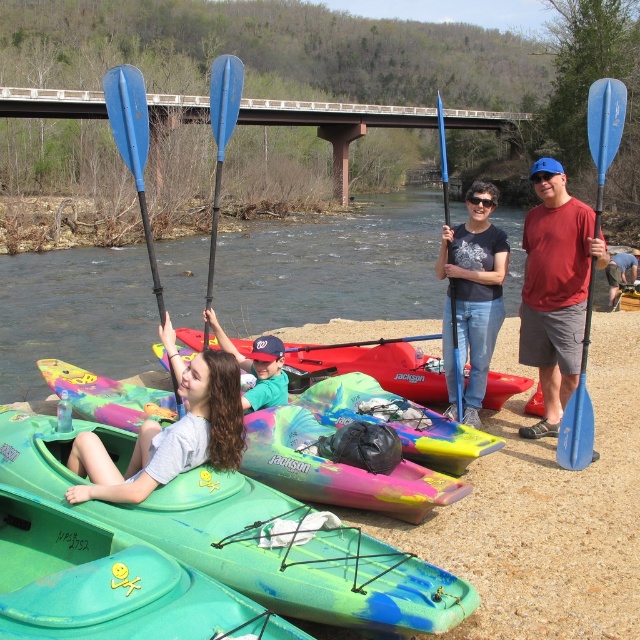
Question: Does clear water at center have a greater width compared to blue plastic paddle at upper center?

Choices:
 (A) yes
 (B) no

Answer: (A)

Question: Does clear water at center appear over blue plastic paddle at center?

Choices:
 (A) yes
 (B) no

Answer: (B)

Question: Estimate the real-world distances between objects in this image. Which object is closer to the matte green kayak at center?

Choices:
 (A) teal matte kayak at center
 (B) matte black t-shirt at center
 (C) denim shorts at center

Answer: (A)

Question: Considering the relative positions of clear water at center and matte red t-shirt at center in the image provided, where is clear water at center located with respect to matte red t-shirt at center?

Choices:
 (A) above
 (B) below

Answer: (A)

Question: Which of these objects is positioned farthest from the matte red t-shirt at center?

Choices:
 (A) blue plastic paddle at upper center
 (B) matte green kayak at center
 (C) green plastic kayak at lower left

Answer: (A)

Question: Based on their relative distances, which object is nearer to the blue plastic paddle at left?

Choices:
 (A) matte green kayak at center
 (B) blue plastic paddle at right

Answer: (A)